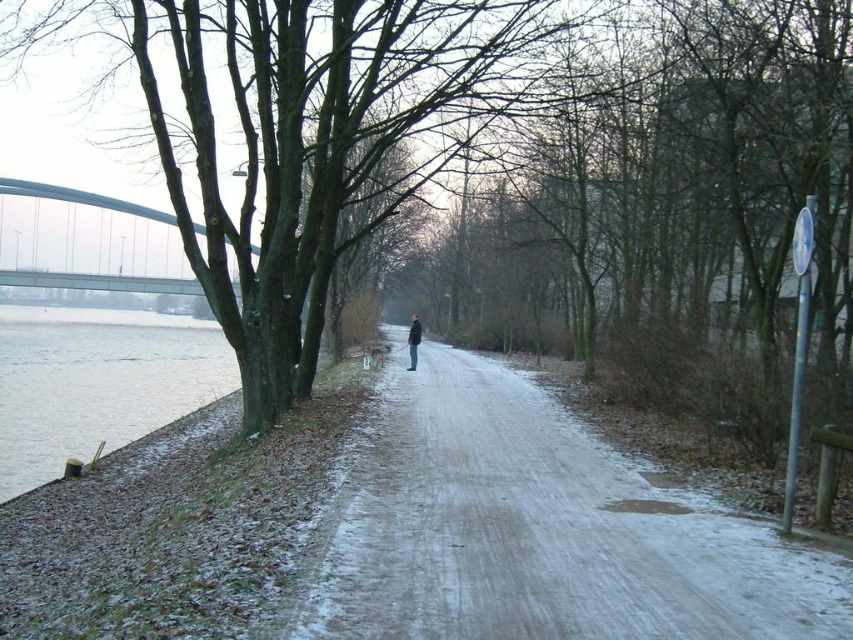
You are a photographer planning to capture a wide shot of the gray concrete bridge at upper left and the dark gray jacket at center. Since you want both objects to be clearly visible in the frame, which object should you position closer to the center of the photo to ensure it isn not cropped out?

The dark gray jacket at center should be positioned closer to the center of the photo because the gray concrete bridge at upper left is wider and can occupy more space without being cropped out.

You are a pedestrian standing on the snow path and see the gray concrete bridge at upper left and the dark gray jacket at center. Which object is bigger in size?

The gray concrete bridge at upper left is larger in size than the dark gray jacket at center.